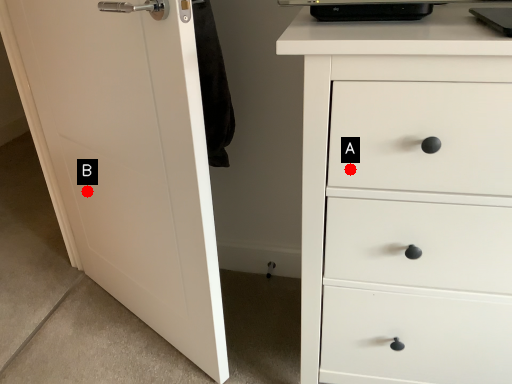
Question: Two points are circled on the image, labeled by A and B beside each circle. Which point appears closest to the camera in this image?

Choices:
 (A) A is closer
 (B) B is closer

Answer: (A)